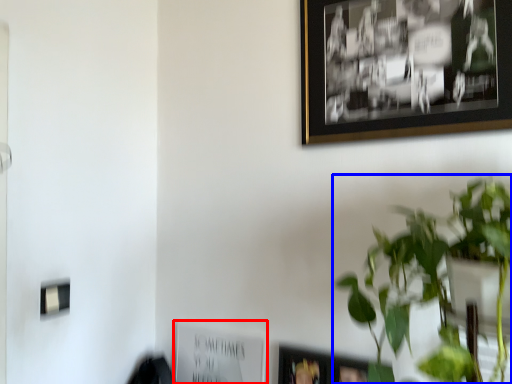
Question: Which object appears farthest to the camera in this image, picture frame (highlighted by a red box) or houseplant (highlighted by a blue box)?

Choices:
 (A) picture frame
 (B) houseplant

Answer: (A)